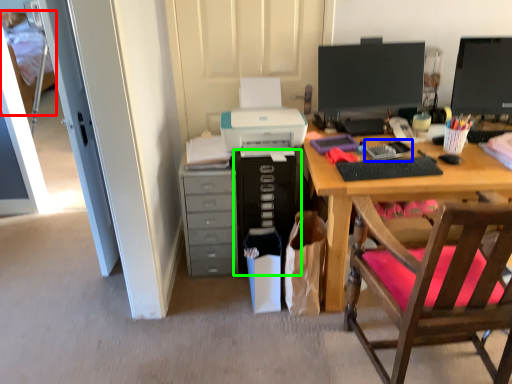
Question: Which object is positioned farthest from bed (highlighted by a red box)? Select from office supplies (highlighted by a blue box) and computer tower (highlighted by a green box).

Choices:
 (A) office supplies
 (B) computer tower

Answer: (A)